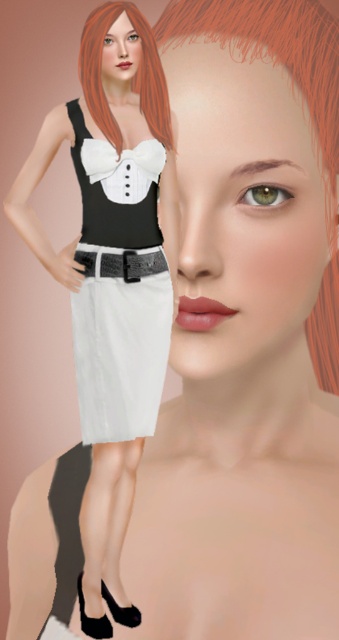
Question: Which point is closer to the camera taking this photo?

Choices:
 (A) (105, 120)
 (B) (83, 253)

Answer: (B)

Question: Does blonde hair at upper left have a lesser width compared to black leather belt at center?

Choices:
 (A) no
 (B) yes

Answer: (A)

Question: Is white matte skirt at center thinner than blonde hair at upper left?

Choices:
 (A) no
 (B) yes

Answer: (A)

Question: Which of the following is the farthest from the observer?

Choices:
 (A) blonde hair at upper left
 (B) black leather belt at center

Answer: (B)

Question: Does blonde hair at upper left appear under black leather belt at center?

Choices:
 (A) no
 (B) yes

Answer: (A)

Question: Which of the following is the farthest from the observer?

Choices:
 (A) (323, 161)
 (B) (89, 406)
 (C) (136, 273)
 (D) (152, 88)

Answer: (C)